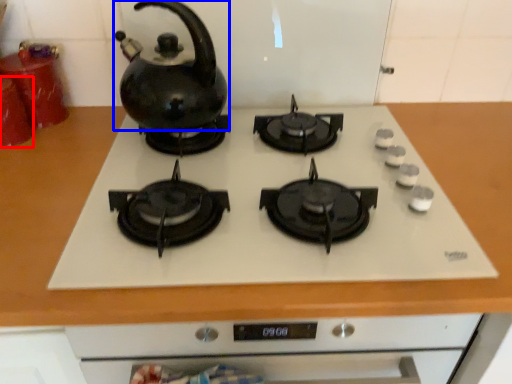
Question: Which object appears closest to the camera in this image, kitchen appliance (highlighted by a red box) or kettle (highlighted by a blue box)?

Choices:
 (A) kitchen appliance
 (B) kettle

Answer: (B)